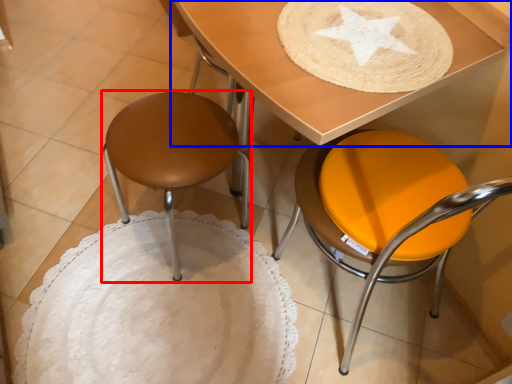
Question: Among these objects, which one is farthest to the camera, stool (highlighted by a red box) or table (highlighted by a blue box)?

Choices:
 (A) stool
 (B) table

Answer: (A)